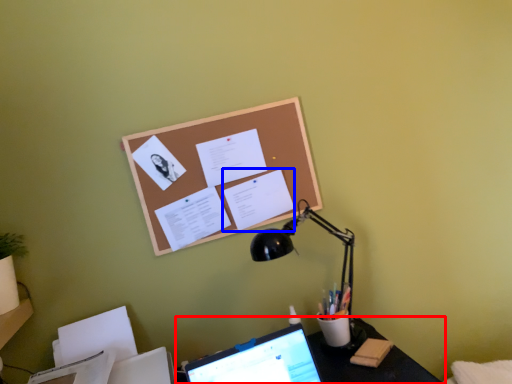
Question: Which point is closer to the camera, desk (highlighted by a red box) or document (highlighted by a blue box)?

Choices:
 (A) desk
 (B) document

Answer: (A)